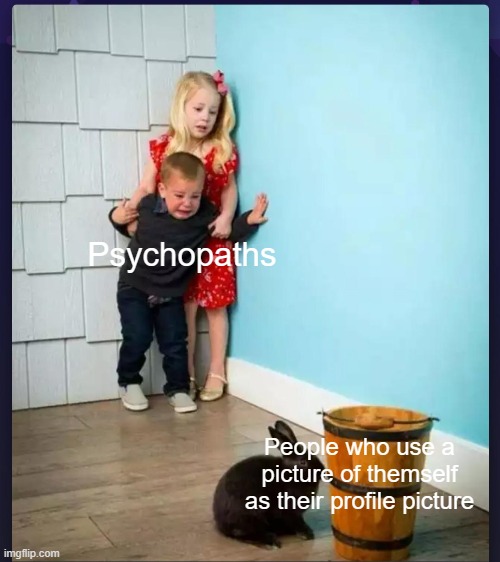
Where is `wood floor`? Image resolution: width=500 pixels, height=562 pixels. wood floor is located at coordinates (127, 524), (202, 439), (463, 536), (60, 447).